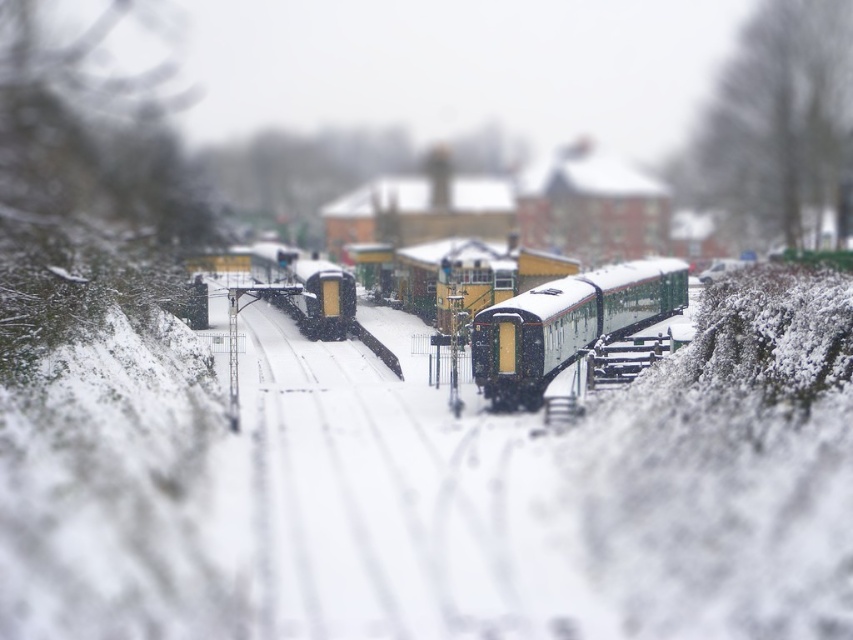
You are a photographer trying to capture the green matte train at center. You have a camera with a zoom lens. Where should you position yourself to ensure the point at coordinates (567, 324) is in your shot?

The point at coordinates (567, 324) is located on the green matte train at center, so positioning yourself directly in front of the green matte train at center will ensure the point is within the frame.